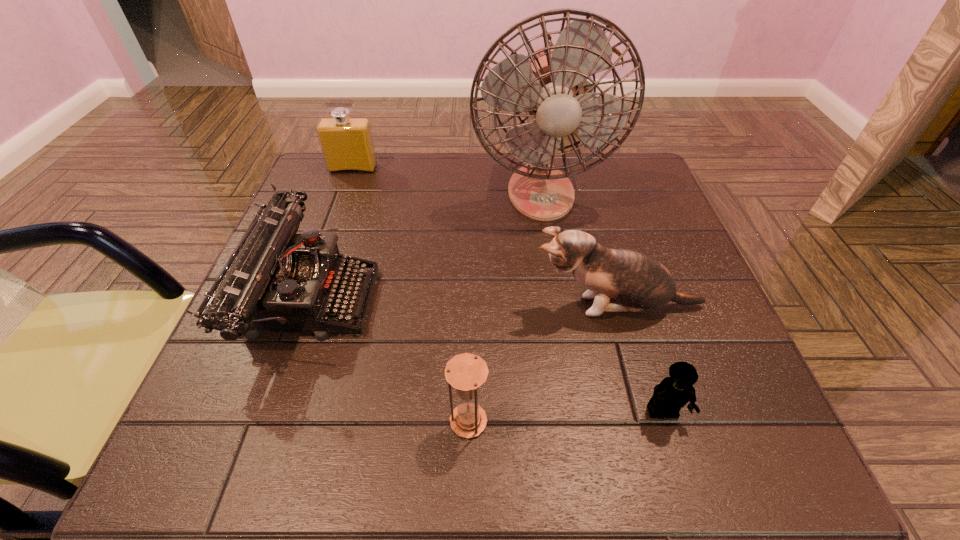
At what (x,y) coordinates should I click in order to perform the action: click on cat at the right edge. Please return your answer as a coordinate pair (x, y). Image resolution: width=960 pixels, height=540 pixels. Looking at the image, I should click on (639, 282).

Identify the location of Lego located at the right edge. This screenshot has height=540, width=960. click(673, 392).

Identify the location of object that is positioned at the far left corner. This screenshot has width=960, height=540. (347, 145).

This screenshot has width=960, height=540. What are the coordinates of `object situated at the far right corner` in the screenshot? It's located at (547, 83).

This screenshot has height=540, width=960. I want to click on object located at the near right corner, so click(x=673, y=392).

I want to click on free point at the far edge, so click(x=507, y=185).

The width and height of the screenshot is (960, 540). Find the location of `blank space at the near edge of the desktop`. blank space at the near edge of the desktop is located at coordinates (366, 418).

In the image, there is a desktop. Where is `vacant region at the far right corner`? Image resolution: width=960 pixels, height=540 pixels. vacant region at the far right corner is located at coordinates (604, 177).

Identify the location of free space at the near right corner. This screenshot has width=960, height=540. (779, 475).

Find the location of a particular element. The height and width of the screenshot is (540, 960). empty space between the typewriter and the tallest object is located at coordinates (425, 245).